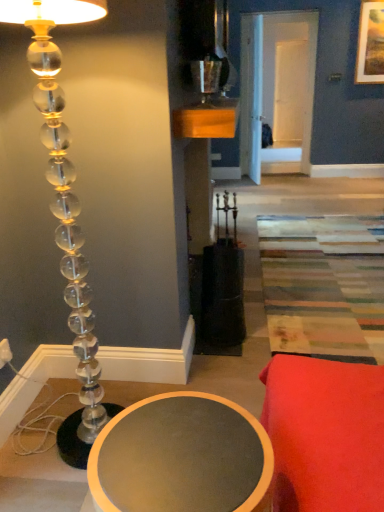
Question: Based on their sizes in the image, would you say metallic silver candle holder at upper center is bigger or smaller than clear acrylic lamp at left?

Choices:
 (A) small
 (B) big

Answer: (A)

Question: Looking at their shapes, would you say metallic silver candle holder at upper center is wider or thinner than clear acrylic lamp at left?

Choices:
 (A) thin
 (B) wide

Answer: (A)

Question: Considering the real-world distances, which object is closest to the metallic silver candle holder at upper center?

Choices:
 (A) clear acrylic lamp at left
 (B) wooden framed landscape painting at upper right
 (C) matte gray table at lower left

Answer: (A)

Question: Which object is the farthest from the matte gray table at lower left?

Choices:
 (A) wooden framed landscape painting at upper right
 (B) clear acrylic lamp at left
 (C) metallic silver candle holder at upper center

Answer: (A)